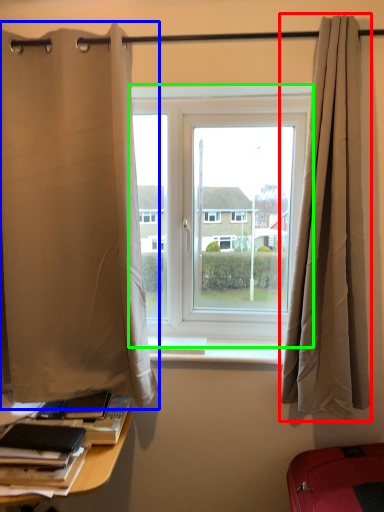
Question: Which object is positioned closest to curtain (highlighted by a red box)? Select from curtain (highlighted by a blue box) and window (highlighted by a green box).

Choices:
 (A) curtain
 (B) window

Answer: (B)